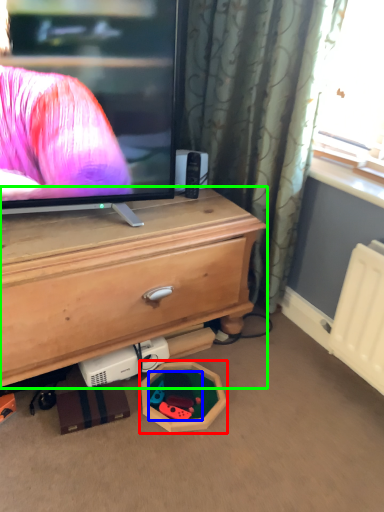
Question: Considering the real-world distances, which object is closest to toy (highlighted by a red box)? toy (highlighted by a blue box) or chest of drawers (highlighted by a green box).

Choices:
 (A) toy
 (B) chest of drawers

Answer: (A)